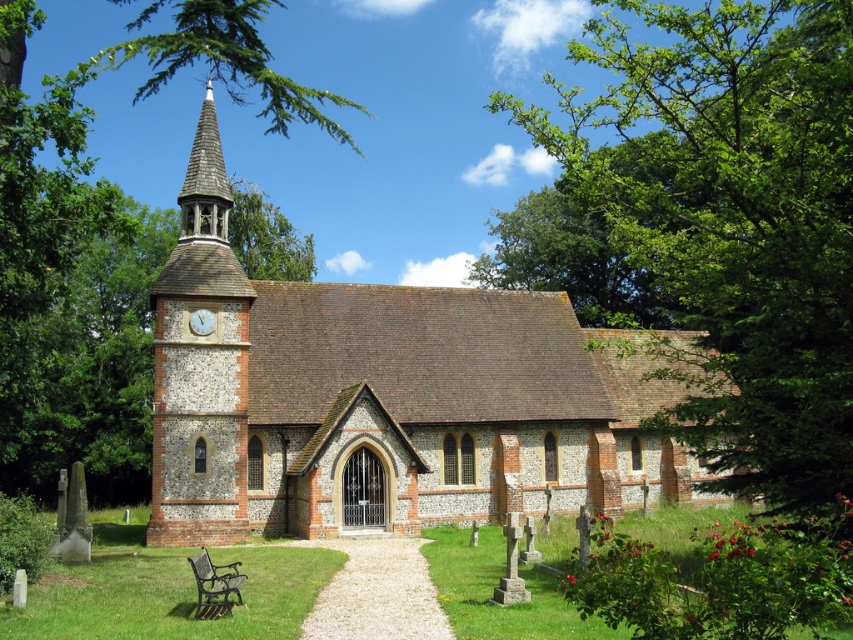
Is point (665, 193) less distant than point (194, 326)?

Yes, it is.

Which is behind, point (734, 113) or point (192, 323)?

Point (192, 323)

At what (x,y) coordinates should I click in order to perform the action: click on green leafy tree at upper right. Please return your answer as a coordinate pair (x, y). Image resolution: width=853 pixels, height=640 pixels. Looking at the image, I should click on (730, 224).

Does brick church at center have a greater width compared to green leafy tree at upper left?

No.

Is brick church at center to the left of green leafy tree at upper left from the viewer's perspective?

In fact, brick church at center is to the right of green leafy tree at upper left.

This screenshot has height=640, width=853. Identify the location of brick church at center. click(x=389, y=406).

At what (x,y) coordinates should I click in order to perform the action: click on brick church at center. Please return your answer as a coordinate pair (x, y). This screenshot has width=853, height=640. Looking at the image, I should click on (389, 406).

Which is behind, point (193, 417) or point (218, 140)?

The point (218, 140) is more distant.

Is stone clock tower at left wider than wooden shingles spire at upper center?

Indeed, stone clock tower at left has a greater width compared to wooden shingles spire at upper center.

Which is in front, point (235, 440) or point (219, 188)?

Point (235, 440) is more forward.

Identify the location of stone clock tower at left. (200, 364).